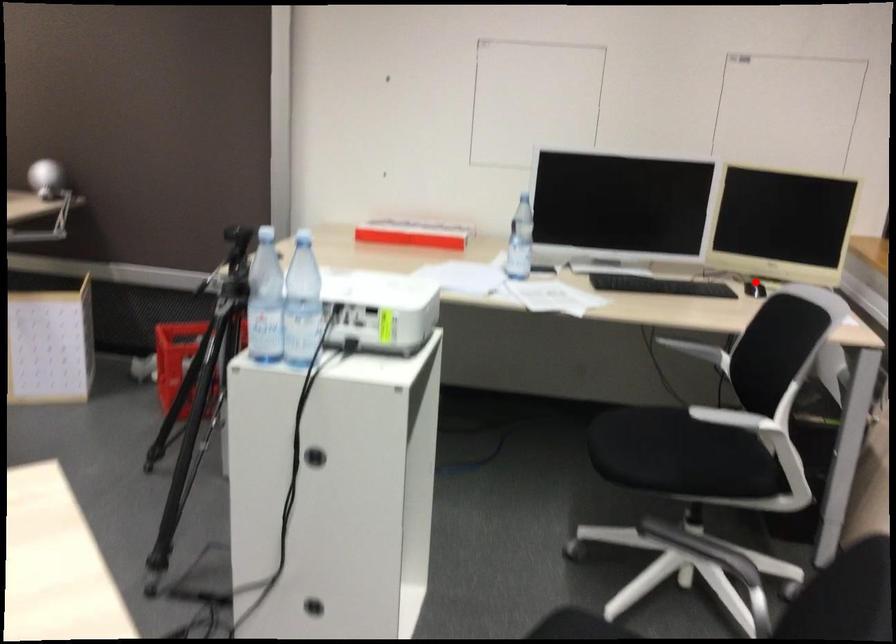
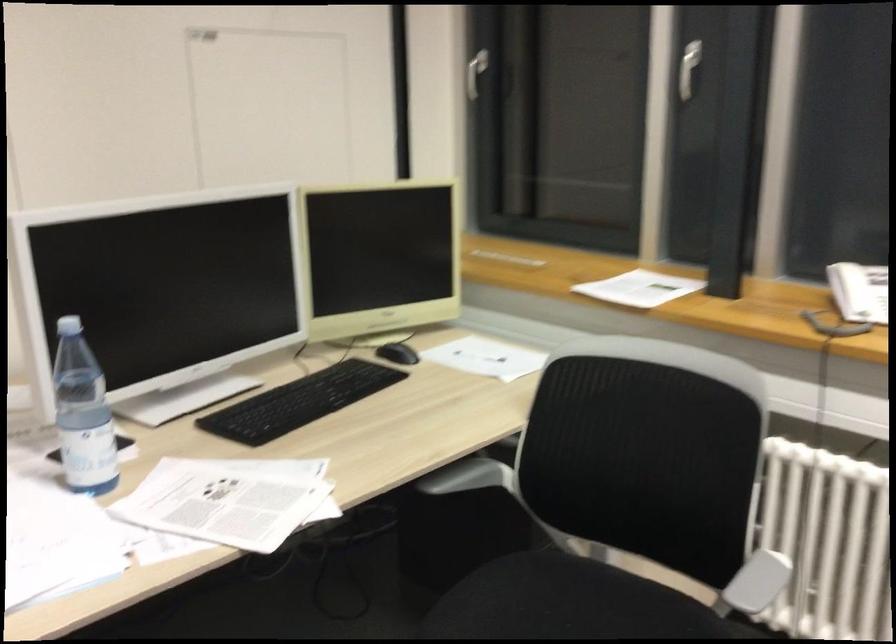
Question: I am providing you with two images of the same scene from different viewpoints. In image1, a red point is highlighted. Considering the same 3D point in image2, which of the following is correct?

Choices:
 (A) It is closer
 (B) It is farther

Answer: (A)